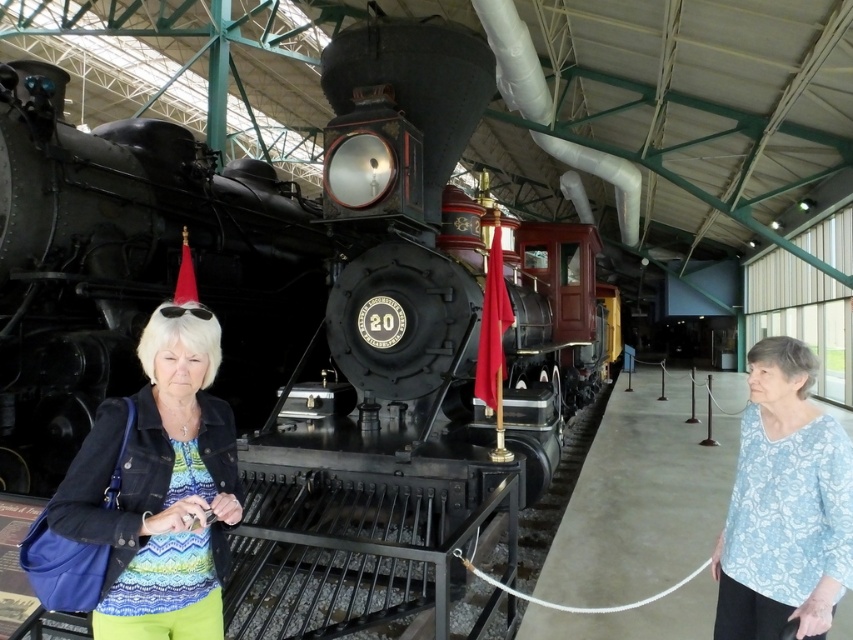
You are standing at the entrance of the train museum and see two points marked in the image. Which point is closer to you, point [146,328] or point [804,588]?

Point [146,328] is in front of point [804,588], so it is closer to you.

You are standing at the point marked as point (160, 486) in the image. What is the nearest object to you?

The nearest object to you at point (160, 486) is the denim jacket at center.